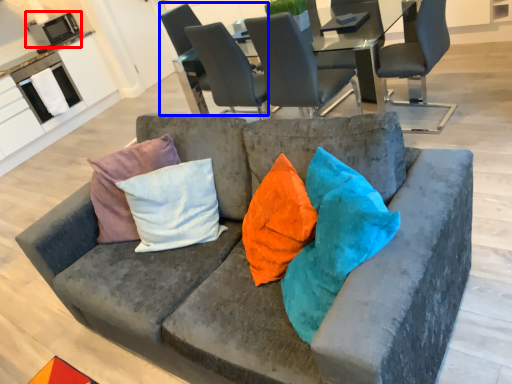
Question: Which object is closer to the camera taking this photo, appliance (highlighted by a red box) or chair (highlighted by a blue box)?

Choices:
 (A) appliance
 (B) chair

Answer: (B)